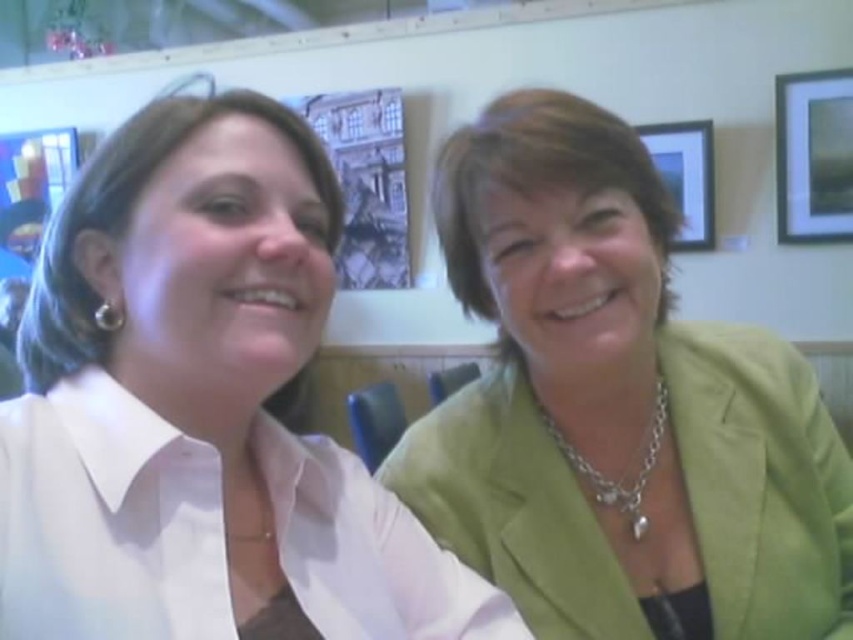
Question: Can you confirm if matte white blouse at left is bigger than green fabric jacket at right?

Choices:
 (A) no
 (B) yes

Answer: (A)

Question: Is matte black picture frame at upper right smaller than wooden picture frame at upper right?

Choices:
 (A) no
 (B) yes

Answer: (B)

Question: Can you confirm if green fabric jacket at right is thinner than matte black picture frame at upper right?

Choices:
 (A) no
 (B) yes

Answer: (A)

Question: Which point is farther to the camera?

Choices:
 (A) matte black picture frame at upper right
 (B) matte white blouse at left
 (C) wooden picture frame at upper right
 (D) green fabric jacket at right

Answer: (C)

Question: Estimate the real-world distances between objects in this image. Which object is closer to the wooden picture frame at upper right?

Choices:
 (A) matte white blouse at left
 (B) matte black picture frame at upper right
 (C) green fabric jacket at right

Answer: (B)

Question: Which point is farther to the camera?

Choices:
 (A) green fabric jacket at right
 (B) matte white blouse at left

Answer: (A)